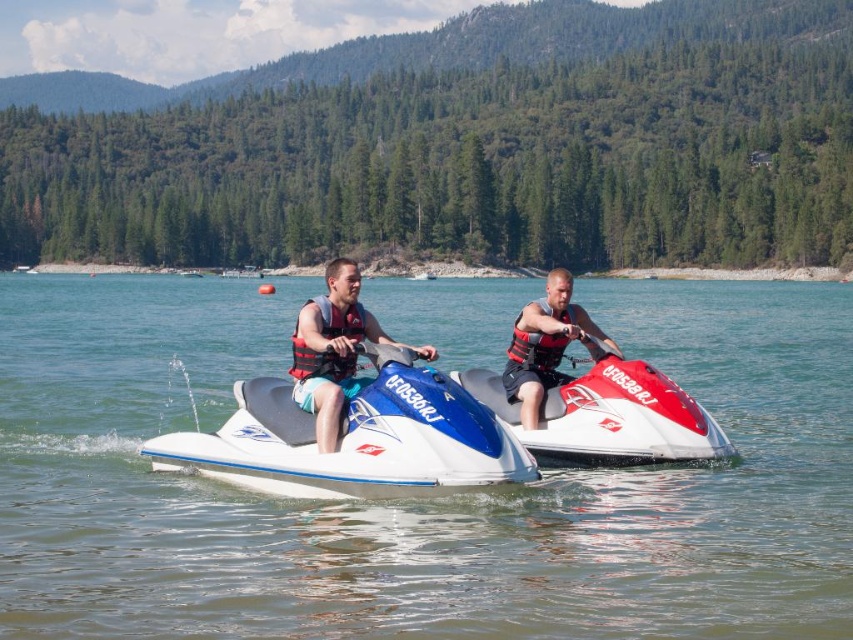
Which is behind, point (328, 314) or point (526, 362)?

The point (526, 362) is behind.

Between point (351, 310) and point (550, 342), which one is positioned in front?

Point (351, 310) is in front.

Is point (305, 372) closer to viewer compared to point (524, 356)?

Yes, point (305, 372) is closer to viewer.

Locate an element on the screen. The width and height of the screenshot is (853, 640). matte red life vest at center is located at coordinates (334, 349).

Which is below, matte red life vest at center or red nylon life jacket at center?

red nylon life jacket at center is lower down.

Measure the distance between point (434, 348) and camera.

Point (434, 348) and camera are 41.11 meters apart.

Find the location of a particular element. Image resolution: width=853 pixels, height=640 pixels. matte red life vest at center is located at coordinates (334, 349).

Which of these two, matte red life vest at center or red and white jet ski at center, stands shorter?

Standing shorter between the two is red and white jet ski at center.

Does point (318, 410) come behind point (541, 394)?

No, it is not.

Find the location of a particular element. The image size is (853, 640). matte red life vest at center is located at coordinates (334, 349).